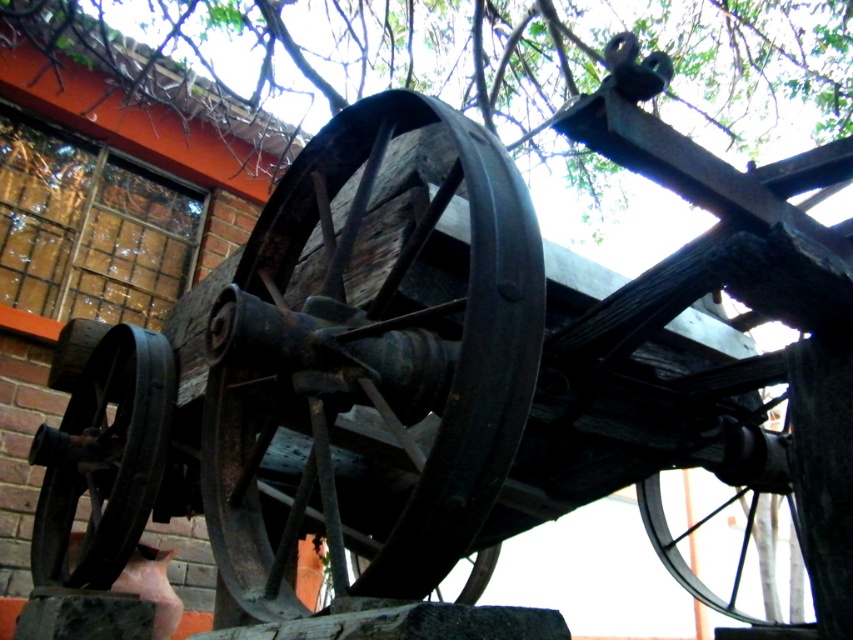
You are standing in front of an old wooden cart wheel. There are two points marked on the wheel at coordinates point (247, 444) and point (444, 600). Which point is closer to you?

Point (247, 444) is closer to the viewer than point (444, 600).

You are standing in a field and see the green wood tree at upper center and the rusty metal wheel at lower center. Which object is closer to you?

The green wood tree at upper center is closer to you because it is in front of the rusty metal wheel at lower center.

You are standing in front of a rustic wooden cart. You notice two rusty metal wheels. The first is the rusty metal wheel at center, and the second is the rusty metal wheel at lower center. Which wheel is positioned to the left when viewed from the front of the cart?

The rusty metal wheel at center is to the left of the rusty metal wheel at lower center.